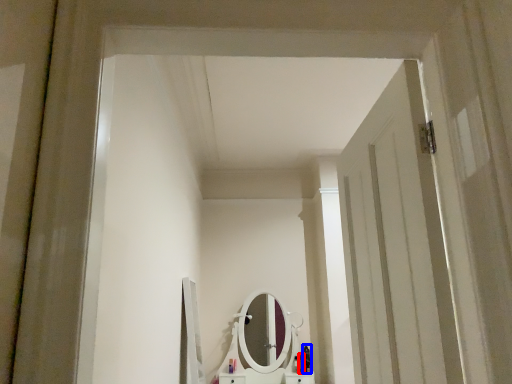
Question: Among these objects, which one is nearest to the camera, toiletry (highlighted by a red box) or toiletry (highlighted by a blue box)?

Choices:
 (A) toiletry
 (B) toiletry

Answer: (A)